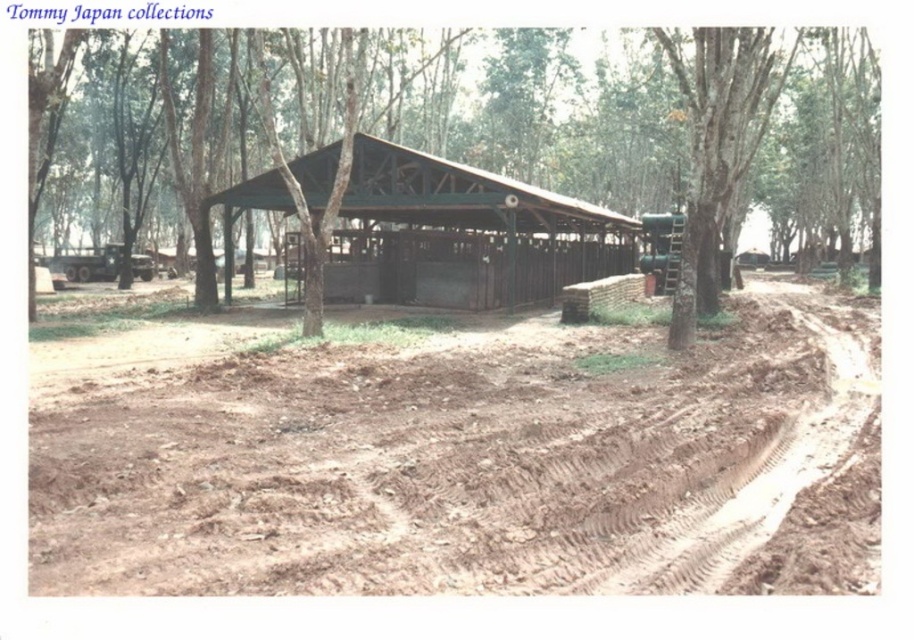
You are standing at the origin point in the image. You want to walk to the green wood tree at center. What are the coordinates you need to move to?

The coordinates you need to move to are 0.183 in the x direction and 0.624 in the y direction to reach the green wood tree at center.